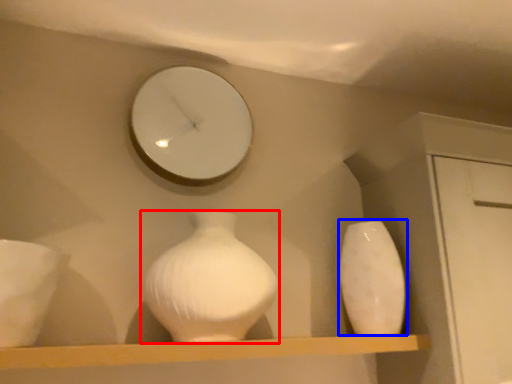
Question: Which object appears farthest to the camera in this image, vase (highlighted by a red box) or vase (highlighted by a blue box)?

Choices:
 (A) vase
 (B) vase

Answer: (B)